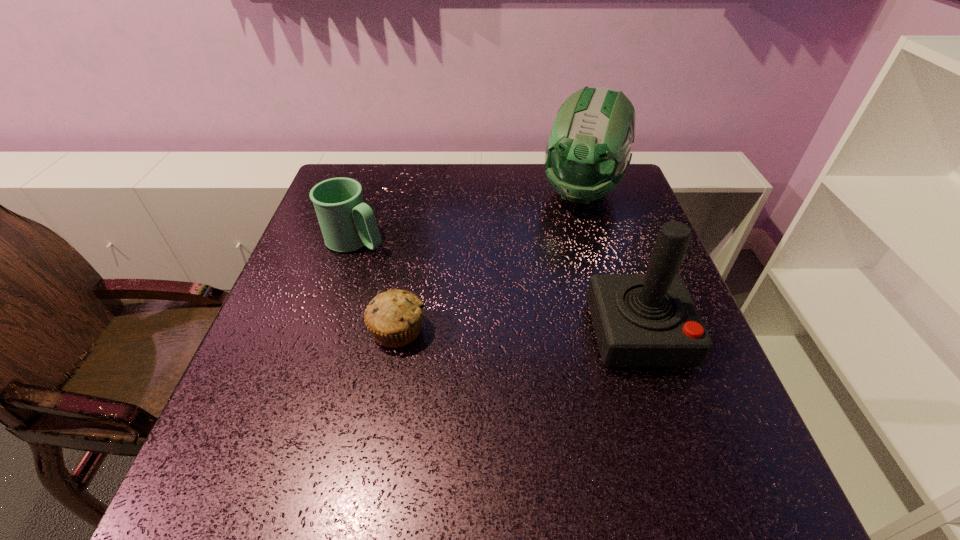
I want to click on vacant space located 0.150m on the visor of the football helmet, so click(x=559, y=254).

The width and height of the screenshot is (960, 540). I want to click on vacant region located 0.220m on the side of the second farthest object with the handle, so click(x=448, y=290).

Find the location of `vacant position located 0.230m on the side of the second farthest object with the handle`. vacant position located 0.230m on the side of the second farthest object with the handle is located at coordinates (451, 292).

The height and width of the screenshot is (540, 960). In order to click on free space located on the side of the second farthest object with the handle in this screenshot , I will do `click(507, 322)`.

Locate an element on the screen. The width and height of the screenshot is (960, 540). object that is at the far edge is located at coordinates (588, 150).

In order to click on object situated at the left edge in this screenshot , I will do `click(347, 223)`.

Locate an element on the screen. The image size is (960, 540). joystick that is at the right edge is located at coordinates (640, 320).

This screenshot has height=540, width=960. I want to click on football helmet that is at the right edge, so click(x=588, y=150).

The height and width of the screenshot is (540, 960). What are the coordinates of `object that is at the far right corner` in the screenshot? It's located at pos(588,150).

Where is `free space at the far edge`? free space at the far edge is located at coordinates (427, 202).